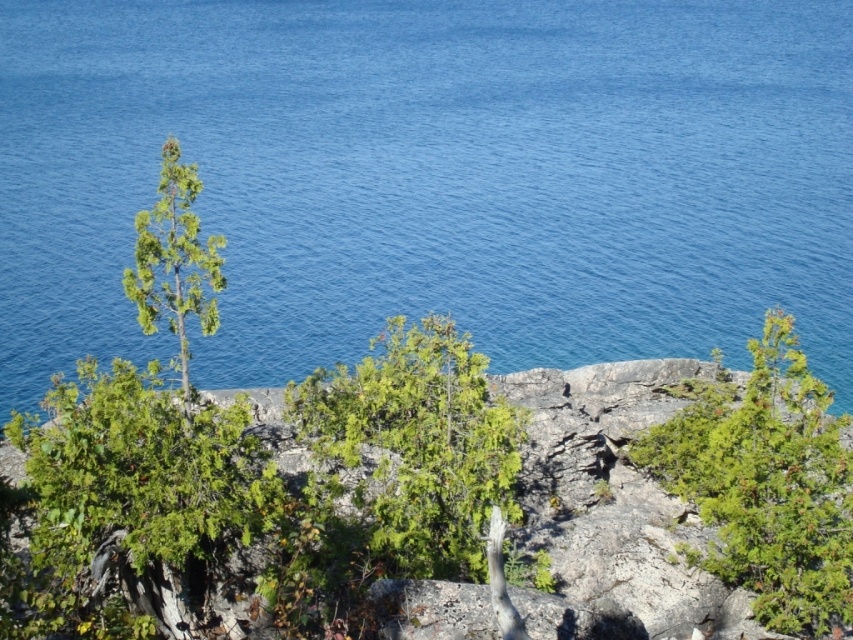
Who is more forward, (445, 568) or (206, 284)?

Positioned in front is point (445, 568).

Between green leafy shrub at center and green matte tree at upper left, which one has less height?

green leafy shrub at center

Who is more distant from viewer, (x=384, y=428) or (x=181, y=205)?

The point (x=384, y=428) is behind.

I want to click on green leafy shrub at center, so click(x=412, y=449).

Can you confirm if green textured shrub at center-right is positioned to the left of green matte tree at upper left?

No, green textured shrub at center-right is not to the left of green matte tree at upper left.

Which of these two, green textured shrub at center-right or green matte tree at upper left, stands shorter?

With less height is green textured shrub at center-right.

Locate an element on the screen. The height and width of the screenshot is (640, 853). green textured shrub at center-right is located at coordinates (766, 483).

Where is `green textured shrub at center-right`? green textured shrub at center-right is located at coordinates (766, 483).

The height and width of the screenshot is (640, 853). I want to click on blue water at upper center, so click(x=431, y=179).